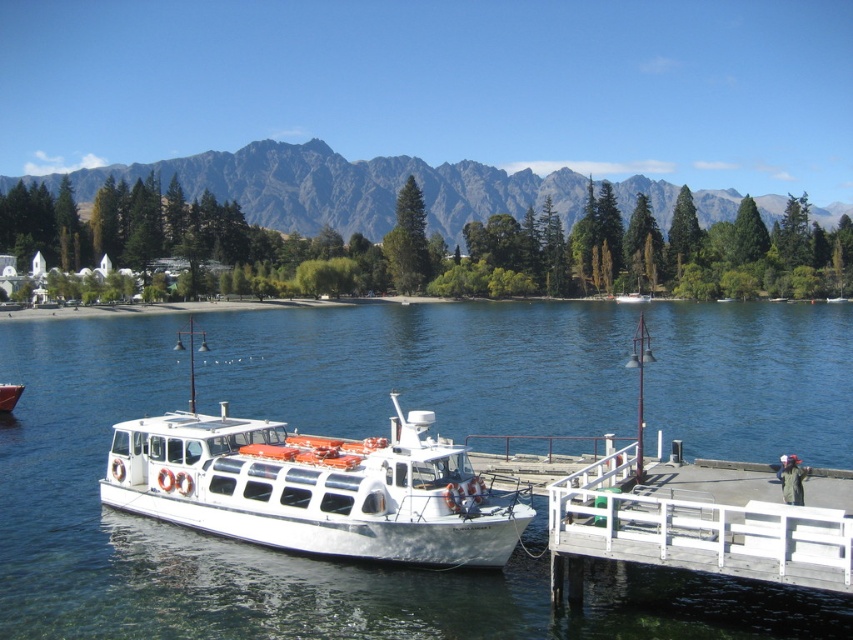
Who is more forward, (767, 198) or (3, 406)?

Point (3, 406) is in front.

Is point (189, 198) closer to viewer compared to point (9, 408)?

No, it is behind (9, 408).

I want to click on gray rocky mountain at upper center, so click(x=347, y=188).

Find the location of a particular element. This screenshot has width=853, height=640. gray rocky mountain at upper center is located at coordinates (347, 188).

Can you confirm if white glossy boat at center is positioned above white glossy boat at lower left?

Yes.

The height and width of the screenshot is (640, 853). Describe the element at coordinates (314, 486) in the screenshot. I see `white glossy boat at center` at that location.

At what (x,y) coordinates should I click in order to perform the action: click on white glossy boat at center. Please return your answer as a coordinate pair (x, y). The height and width of the screenshot is (640, 853). Looking at the image, I should click on (314, 486).

Does clear blue water at center come behind white glossy boat at lower left?

That is False.

Is point (459, 385) behind point (10, 392)?

Yes, it is.

Does point (80, 493) come in front of point (12, 396)?

That is True.

The width and height of the screenshot is (853, 640). In order to click on clear blue water at center in this screenshot , I will do `click(270, 548)`.